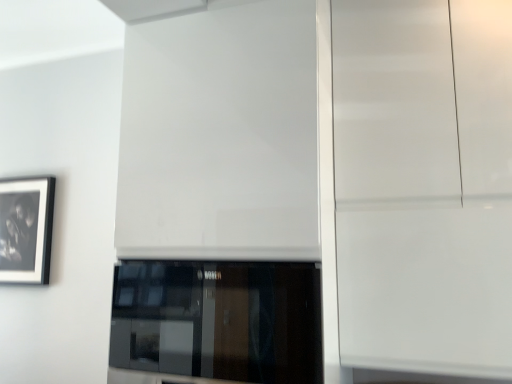
Question: Considering the relative sizes of black glass window at center and glossy white cabinet at right in the image provided, is black glass window at center wider than glossy white cabinet at right?

Choices:
 (A) no
 (B) yes

Answer: (B)

Question: Can you confirm if black glass window at center is shorter than glossy white cabinet at right?

Choices:
 (A) no
 (B) yes

Answer: (B)

Question: Can you confirm if black glass window at center is thinner than glossy white cabinet at right?

Choices:
 (A) yes
 (B) no

Answer: (B)

Question: Considering the relative positions of black glass window at center and glossy white cabinet at right in the image provided, is black glass window at center behind glossy white cabinet at right?

Choices:
 (A) no
 (B) yes

Answer: (A)

Question: Can you confirm if black glass window at center is taller than glossy white cabinet at right?

Choices:
 (A) no
 (B) yes

Answer: (A)

Question: Does black glass window at center appear on the right side of glossy white cabinet at right?

Choices:
 (A) yes
 (B) no

Answer: (B)

Question: From the image's perspective, is black glass window at center below black matte picture frame at left?

Choices:
 (A) yes
 (B) no

Answer: (A)

Question: From a real-world perspective, is black glass window at center positioned under black matte picture frame at left based on gravity?

Choices:
 (A) no
 (B) yes

Answer: (B)

Question: Is there a large distance between black glass window at center and black matte picture frame at left?

Choices:
 (A) no
 (B) yes

Answer: (B)

Question: Is black glass window at center further to camera compared to black matte picture frame at left?

Choices:
 (A) no
 (B) yes

Answer: (A)

Question: Is black glass window at center at the left side of black matte picture frame at left?

Choices:
 (A) yes
 (B) no

Answer: (B)

Question: Is black glass window at center thinner than black matte picture frame at left?

Choices:
 (A) yes
 (B) no

Answer: (B)

Question: Can you confirm if white glossy door at center is bigger than black matte picture frame at left?

Choices:
 (A) no
 (B) yes

Answer: (B)